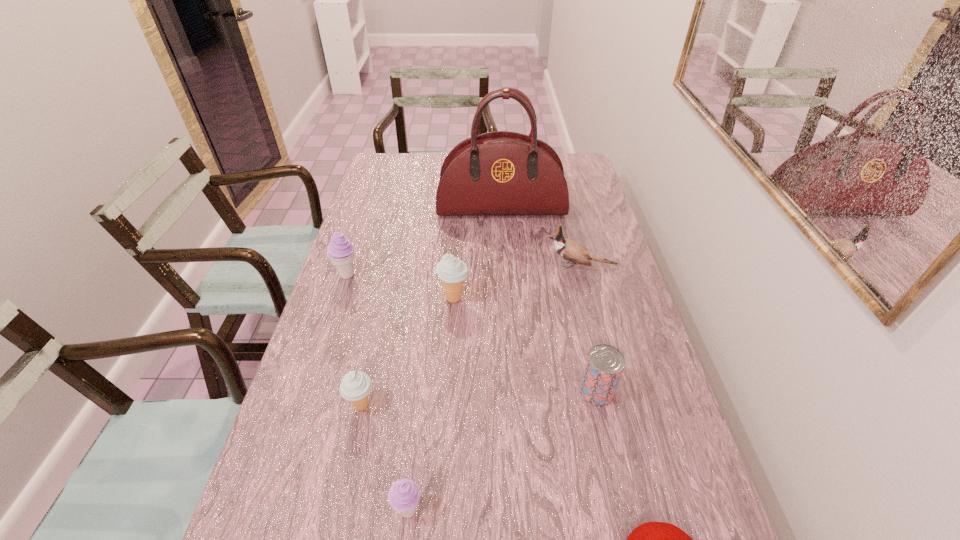
Locate an element on the screen. the farthest object is located at coordinates (497, 173).

At what (x,y) coordinates should I click in order to perform the action: click on brown handbag. Please return your answer as a coordinate pair (x, y). Looking at the image, I should click on click(497, 173).

At what (x,y) coordinates should I click in order to perform the action: click on the bigger beige icecream. Please return your answer as a coordinate pair (x, y). The height and width of the screenshot is (540, 960). Looking at the image, I should click on (452, 271).

Find the location of a particular element. the farther beige icecream is located at coordinates (452, 271).

Where is `the farthest icecream`? The height and width of the screenshot is (540, 960). the farthest icecream is located at coordinates (340, 251).

You are a GUI agent. You are given a task and a screenshot of the screen. Output one action in this format:
    pyautogui.click(x=<x>, y=<y>)
    Task: Click on the bigger purple icecream
    The image size is (960, 540).
    Given the screenshot: What is the action you would take?
    pyautogui.click(x=340, y=251)

I want to click on bird, so click(569, 250).

This screenshot has width=960, height=540. Identify the location of red beer can. (604, 366).

Find the location of a particular element. This screenshot has height=540, width=960. the nearer purple icecream is located at coordinates (403, 496).

What are the coordinates of `the nearest icecream` in the screenshot? It's located at (403, 496).